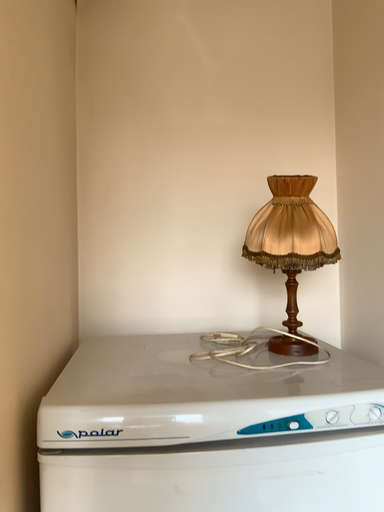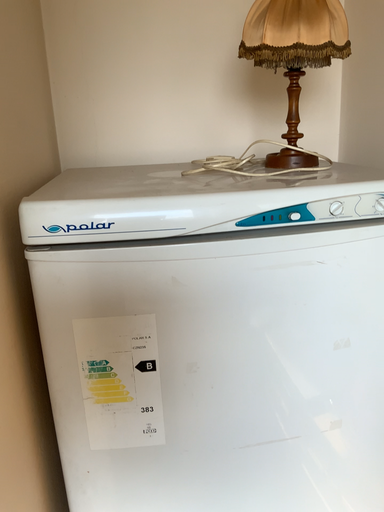
Question: How did the camera likely rotate when shooting the video?

Choices:
 (A) rotated upward
 (B) rotated downward

Answer: (B)